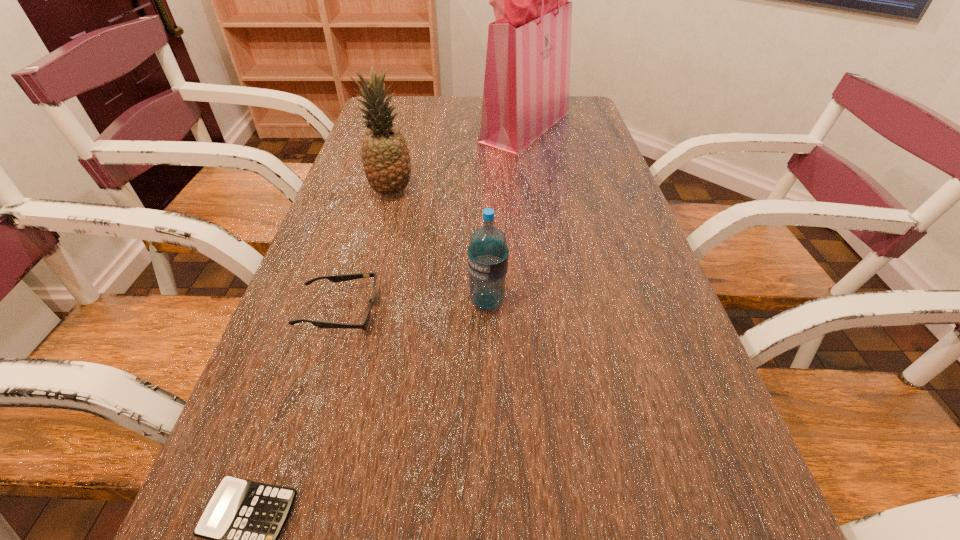
Identify the location of free area in between the third shortest object and the fourth nearest object. The image size is (960, 540). (440, 246).

Find the location of a particular element. Image resolution: width=960 pixels, height=540 pixels. vacant space in between the farthest object and the water bottle is located at coordinates (506, 214).

Identify the location of free point between the sunglasses and the fourth nearest object. (365, 252).

At what (x,y) coordinates should I click in order to perform the action: click on vacant area between the farthest object and the water bottle. Please return your answer as a coordinate pair (x, y). Image resolution: width=960 pixels, height=540 pixels. Looking at the image, I should click on (506, 214).

Find the location of a particular element. The height and width of the screenshot is (540, 960). vacant region between the pineapple and the third tallest object is located at coordinates (440, 246).

The image size is (960, 540). Find the location of `vacant space that's between the water bottle and the second shortest object`. vacant space that's between the water bottle and the second shortest object is located at coordinates (413, 306).

The image size is (960, 540). In order to click on object that is the fourth closest to the calculator in this screenshot , I will do `click(527, 75)`.

Locate an element on the screen. object that is the fourth closest one to the farthest object is located at coordinates (243, 520).